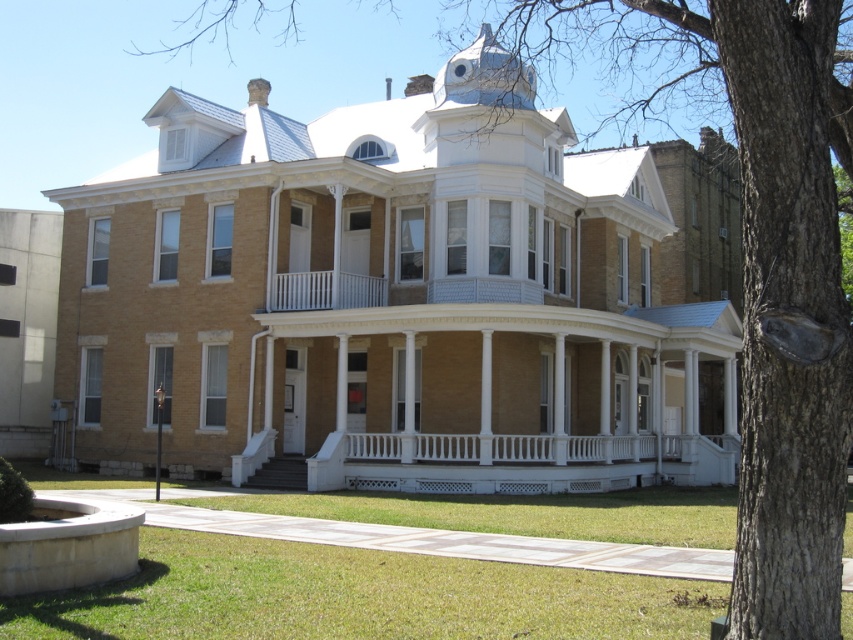
Who is taller, green grass at lower center or white painted wood porch at center?

white painted wood porch at center is taller.

Is point (337, 609) closer to camera compared to point (569, 445)?

Yes, point (337, 609) is in front of point (569, 445).

The height and width of the screenshot is (640, 853). I want to click on green grass at lower center, so click(354, 596).